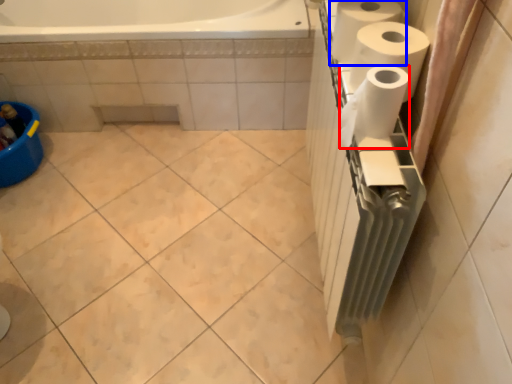
Question: Which of the following is the farthest to the observer, paper towel (highlighted by a red box) or paper towel (highlighted by a blue box)?

Choices:
 (A) paper towel
 (B) paper towel

Answer: (B)